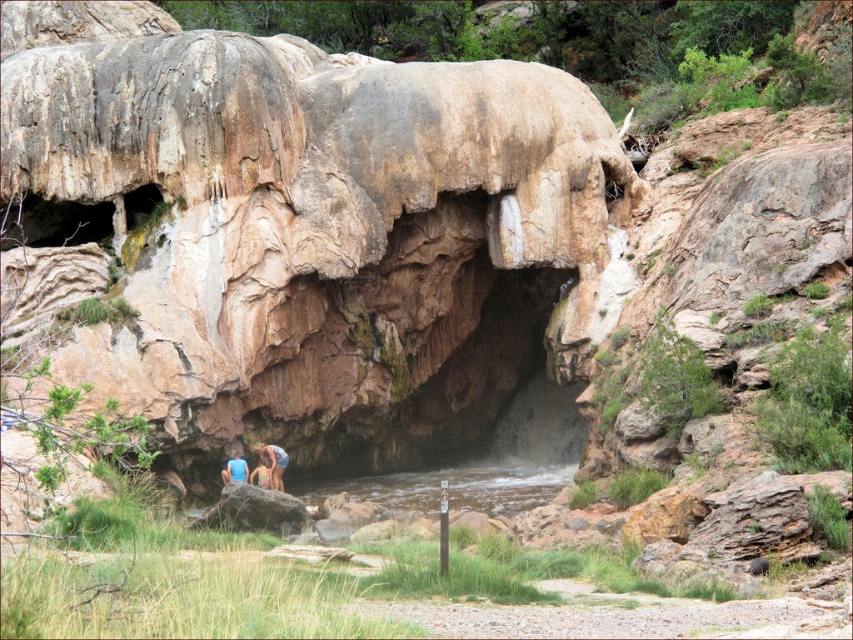
You are standing at the entrance of the cave and want to locate the clear water at stream center. According to the coordinates provided, in which direction should you look to find it?

The clear water at stream center is located at coordinates point (453,484), so you should look towards the lower right direction from the cave entrance to find it.

You are planning to take a photo of the smooth skin couple at center and the clear water at stream center. Which object should you focus on first if you want to capture both in one shot?

You should focus on the smooth skin couple at center first because the clear water at stream center is to the right of smooth skin couple at center, so adjusting focus from the couple to the water to the right would ensure both are in frame.